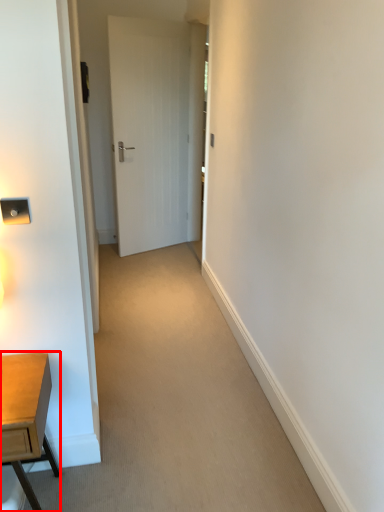
Question: In this image, where is desk (annotated by the red box) located relative to door?

Choices:
 (A) right
 (B) left

Answer: (B)